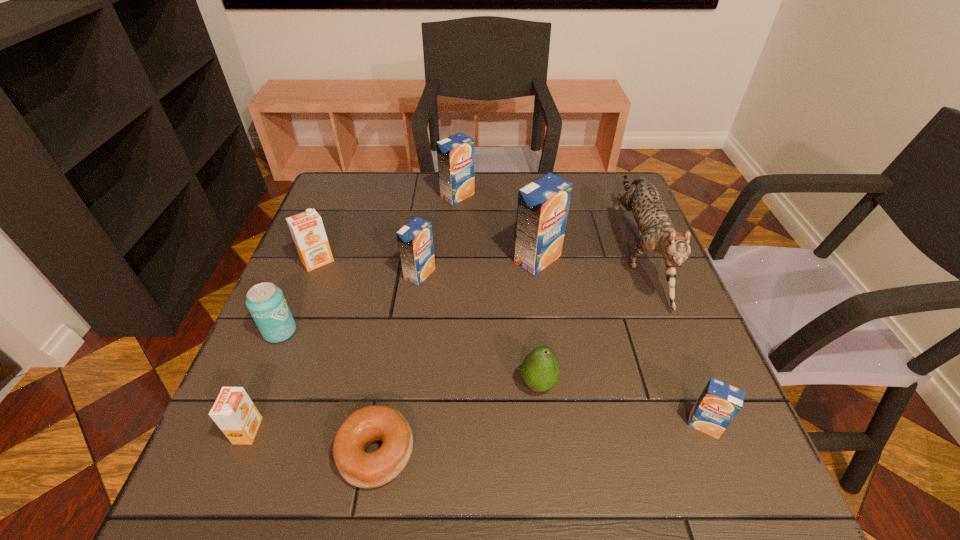
The width and height of the screenshot is (960, 540). In order to click on object that is positioned at the far right corner in this screenshot , I will do click(x=656, y=232).

I want to click on blank space at the far edge of the desktop, so click(525, 171).

In order to click on vacant space at the near edge in this screenshot , I will do `click(407, 508)`.

At what (x,y) coordinates should I click in order to perform the action: click on free space at the left edge of the desktop. Please return your answer as a coordinate pair (x, y). This screenshot has height=540, width=960. Looking at the image, I should click on (334, 261).

Where is `vacant space at the right edge`? This screenshot has width=960, height=540. vacant space at the right edge is located at coordinates (658, 298).

The image size is (960, 540). I want to click on vacant area at the far left corner of the desktop, so click(366, 205).

Locate an element on the screen. vacant area at the near right corner of the desktop is located at coordinates (694, 476).

At what (x,y) coordinates should I click in order to perform the action: click on vacant area between the bigger orange orange juice and the green avocado. Please return your answer as a coordinate pair (x, y). Looking at the image, I should click on (428, 323).

You are a GUI agent. You are given a task and a screenshot of the screen. Output one action in this format:
    pyautogui.click(x=<x>, y=<y>)
    Task: Click on the vacant area between the biggest blue orange_juice and the third smallest blue orange_juice
    
    Given the screenshot: What is the action you would take?
    pyautogui.click(x=497, y=228)

Locate an element on the screen. empty space between the tallest orange juice and the nearest blue orange_juice is located at coordinates (621, 342).